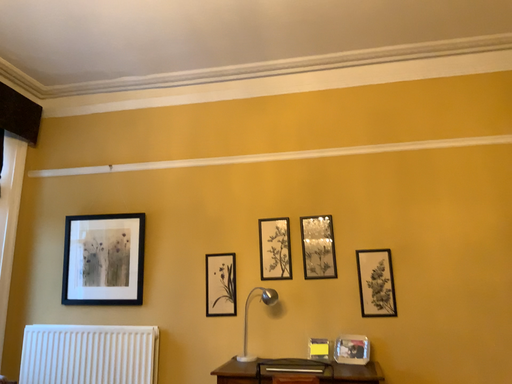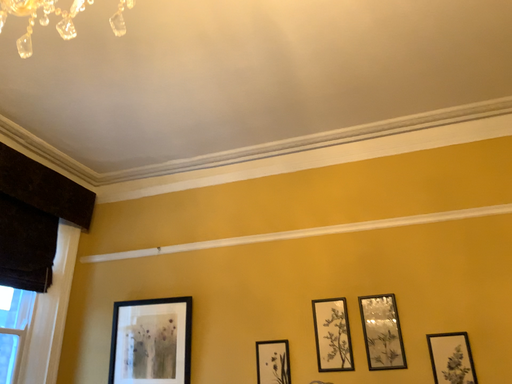
Question: How did the camera likely rotate when shooting the video?

Choices:
 (A) rotated right
 (B) rotated left

Answer: (B)